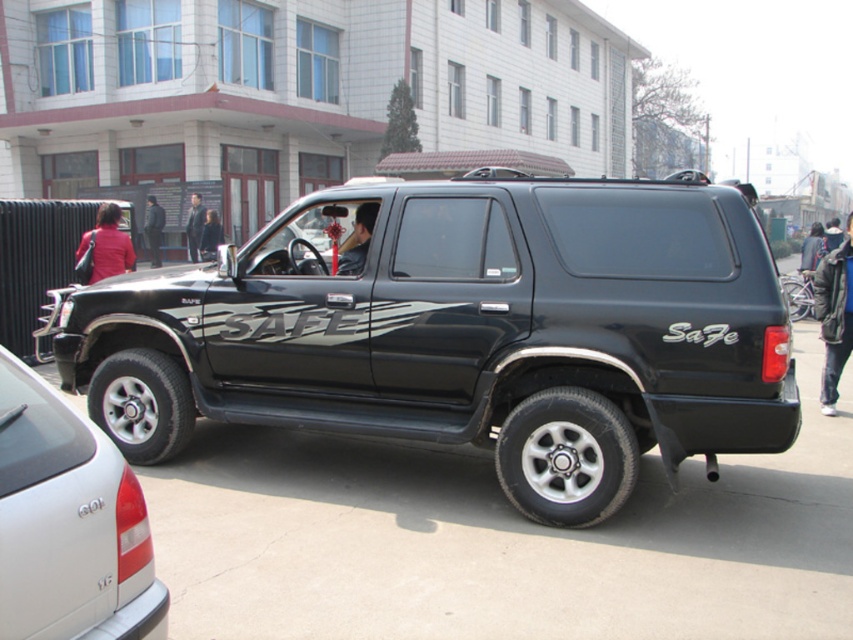
You are standing on the sidewalk in front of the multi story building with white walls. You see two SUVs parked in front of you. Which one is positioned more to the left, the matte black suv at center or the glossy black suv at center?

The glossy black suv at center is positioned more to the left because the matte black suv at center is to the right of it.

You are a parking attendant who needs to fit two identical cars into a parking spot that can only accommodate one car at a time. You see the matte black suv at center and the glossy black suv at center in the image. Which one do you think will require more space in the parking spot?

The matte black suv at center might be wider than glossy black suv at center, so it would require more space in the parking spot.

You are standing in front of the black SUV and want to place a sticker on the point that is closer to you. Which point should you choose between point (410, 259) and point (85, 563)?

Point (85, 563) is closer to you than point (410, 259), so you should choose point (85, 563) to place the sticker.